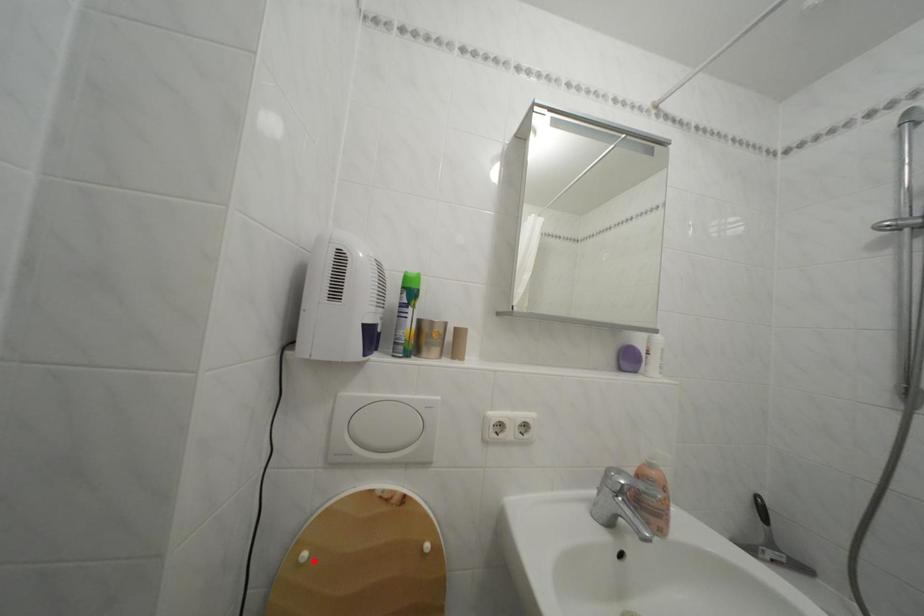
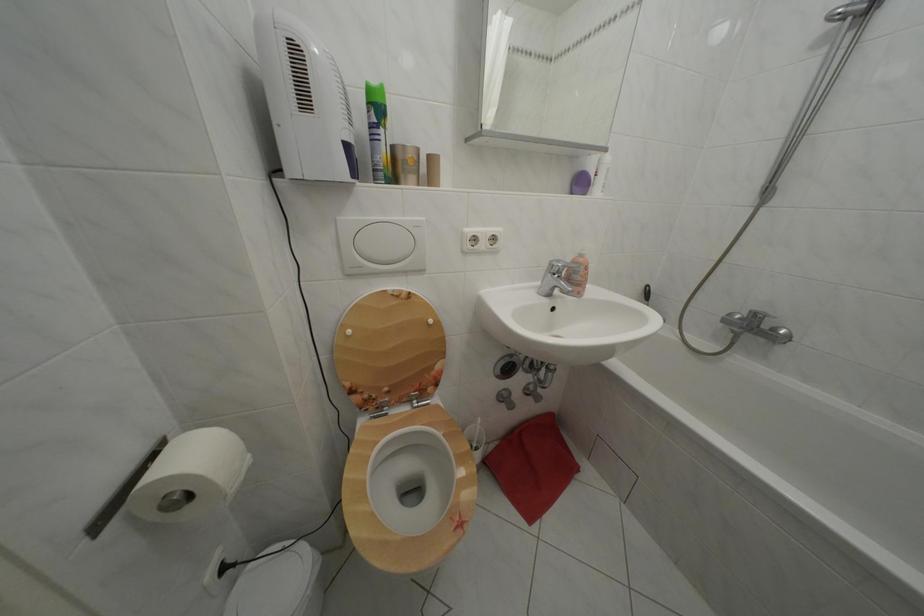
The point at the highlighted location is marked in the first image. Where is the corresponding point in the second image?

(358, 338)